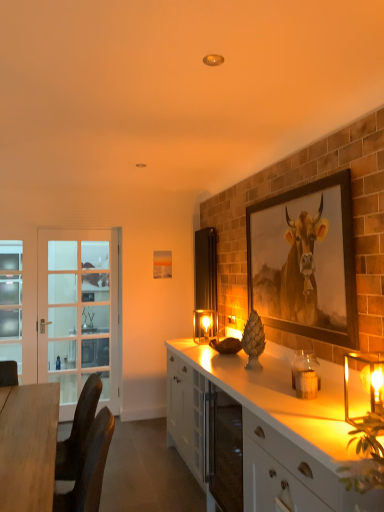
Question: Is matte glass candle holder at center, which is the first candle holder in left-to-right order, positioned in front of white glossy cabinet at center, the 2th cabinetry from the front?

Choices:
 (A) no
 (B) yes

Answer: (A)

Question: From a real-world perspective, does matte glass candle holder at center, which is counted as the third candle holder, starting from the right, stand above white glossy cabinet at center, positioned as the first cabinetry in back-to-front order?

Choices:
 (A) yes
 (B) no

Answer: (A)

Question: Is matte glass candle holder at center, which is the third candle holder from front to back, far away from white glossy cabinet at center, positioned as the first cabinetry in back-to-front order?

Choices:
 (A) no
 (B) yes

Answer: (A)

Question: Is matte glass candle holder at center, which is the first candle holder in left-to-right order, at the right side of white glossy cabinet at center, the 2th cabinetry from the front?

Choices:
 (A) no
 (B) yes

Answer: (A)

Question: Is matte glass candle holder at center, the 1th candle holder when ordered from back to front, taller than white glossy cabinet at center, positioned as the first cabinetry in back-to-front order?

Choices:
 (A) no
 (B) yes

Answer: (A)

Question: Looking at their shapes, would you say white glossy cabinet at lower right, the second cabinetry when ordered from back to front, is wider or thinner than translucent glass candle holder at right, which ranks as the 1th candle holder in front-to-back order?

Choices:
 (A) thin
 (B) wide

Answer: (B)

Question: In the image, is white glossy cabinet at lower right, the second cabinetry when ordered from back to front, positioned in front of or behind translucent glass candle holder at right, the third candle holder in the left-to-right sequence?

Choices:
 (A) front
 (B) behind

Answer: (A)

Question: Considering the positions of point (360, 508) and point (344, 395), is point (360, 508) closer or farther from the camera than point (344, 395)?

Choices:
 (A) farther
 (B) closer

Answer: (B)

Question: Based on their positions, is white glossy cabinet at lower right, the second cabinetry when ordered from back to front, located to the left or right of translucent glass candle holder at right, the third candle holder in the left-to-right sequence?

Choices:
 (A) right
 (B) left

Answer: (B)

Question: Is wooden framed cow portrait at upper right to the left or to the right of light blue frosted glass screen door at left, which appears as the 2th screen door when viewed from the right, in the image?

Choices:
 (A) right
 (B) left

Answer: (A)

Question: Considering the positions of wooden framed cow portrait at upper right and light blue frosted glass screen door at left, which appears as the 2th screen door when viewed from the right, in the image, is wooden framed cow portrait at upper right wider or thinner than light blue frosted glass screen door at left, which appears as the 2th screen door when viewed from the right,?

Choices:
 (A) wide
 (B) thin

Answer: (B)

Question: From a real-world perspective, is wooden framed cow portrait at upper right above or below light blue frosted glass screen door at left, positioned as the first screen door in left-to-right order?

Choices:
 (A) above
 (B) below

Answer: (A)

Question: Relative to light blue frosted glass screen door at left, positioned as the first screen door in left-to-right order, is wooden framed cow portrait at upper right in front or behind?

Choices:
 (A) front
 (B) behind

Answer: (A)

Question: Based on their positions, is white glossy cabinet at lower right, the first cabinetry from the front, located to the left or right of translucent glass candle at right, the 2th candle holder in the back-to-front sequence?

Choices:
 (A) left
 (B) right

Answer: (B)

Question: In terms of height, does white glossy cabinet at lower right, the first cabinetry from the front, look taller or shorter compared to translucent glass candle at right, acting as the 2th candle holder starting from the front?

Choices:
 (A) tall
 (B) short

Answer: (A)